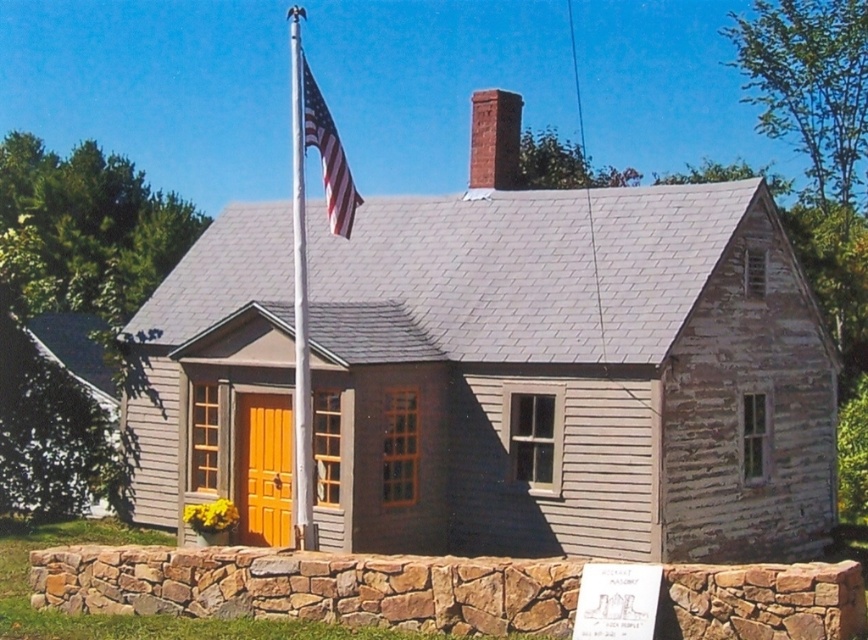
You are standing in front of the house and want to enter through the wooden door at center. However, the american flag at center is blocking your path. Can you walk around the flag to reach the door?

The wooden door at center is below the american flag at center, so the flag is positioned above the door. This means the flag is not blocking your path, so you can walk straight to the door without needing to go around.

You are standing at point (264, 468) in the image. What object are you standing on?

You are standing on the wooden door at center located at point (264, 468).